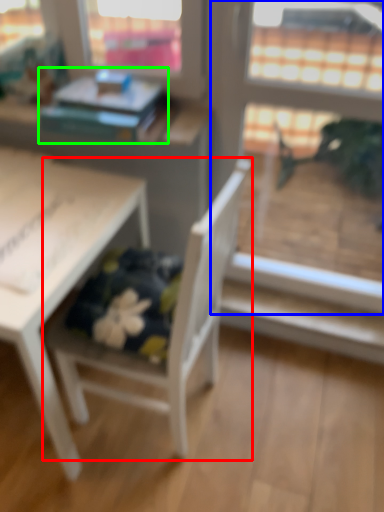
Question: Which object is the closest to the chair (highlighted by a red box)? Choose among these: screen door (highlighted by a blue box) or book (highlighted by a green box).

Choices:
 (A) screen door
 (B) book

Answer: (B)